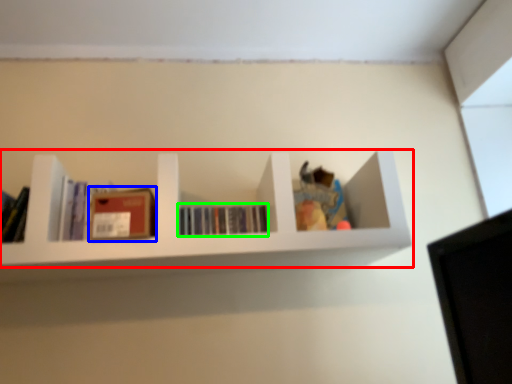
Question: Considering the real-world distances, which object is farthest from shelf (highlighted by a red box)? paperback book (highlighted by a blue box) or book (highlighted by a green box)?

Choices:
 (A) paperback book
 (B) book

Answer: (A)